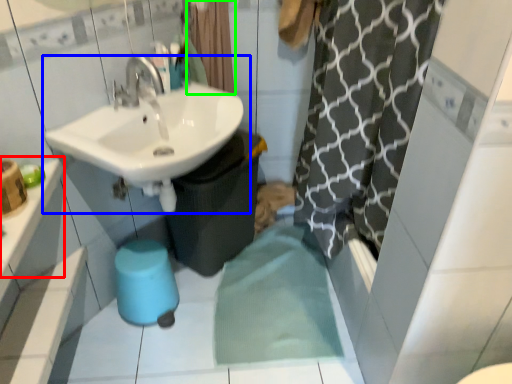
Question: Which is nearer to the counter top (highlighted by a red box)? sink (highlighted by a blue box) or shower curtain (highlighted by a green box).

Choices:
 (A) sink
 (B) shower curtain

Answer: (A)